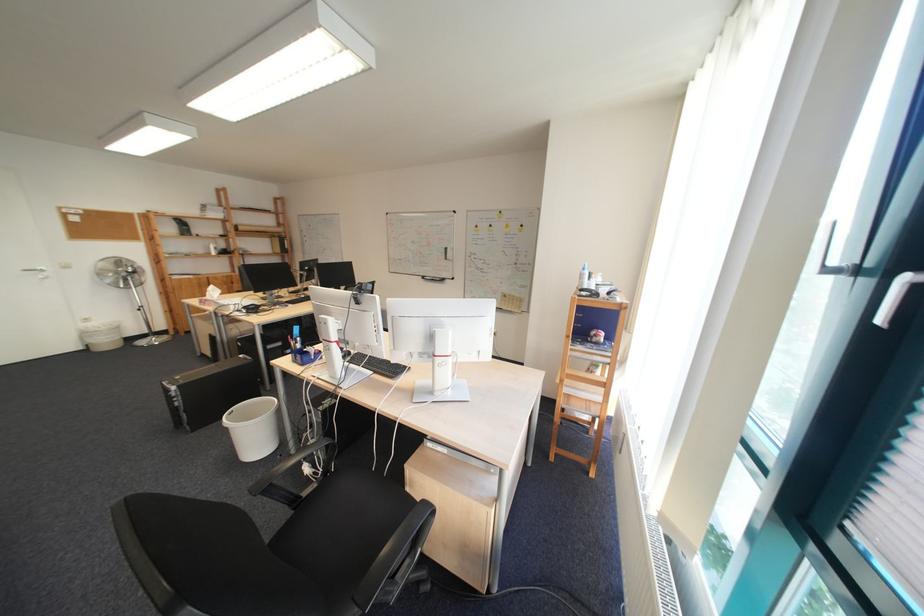
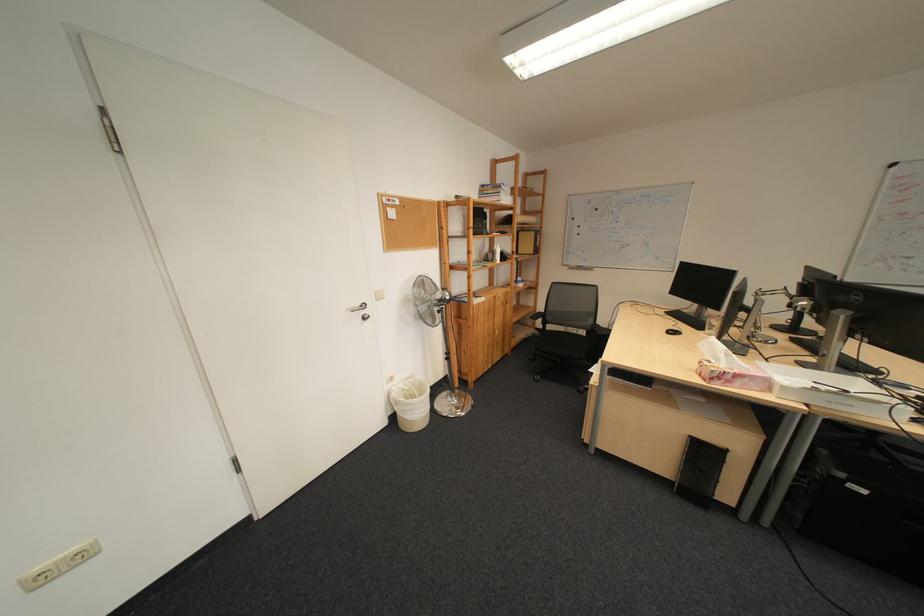
Find the pixel in the second image that matches (x=98, y=323) in the first image.

(402, 386)